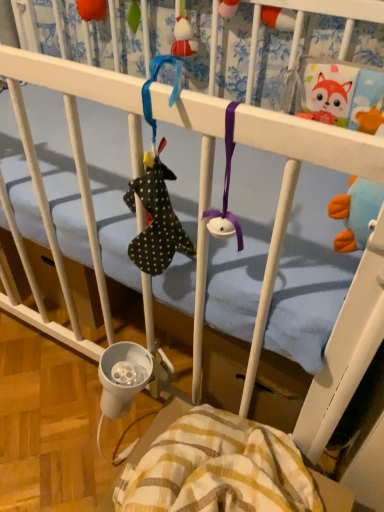
Measure the distance between matte red plush toy at upper center, the first toy positioned from the right, and camera.

matte red plush toy at upper center, the first toy positioned from the right, is 38.58 inches away from camera.

Where is `orange fabric toy at upper left, which is the 2th toy in right-to-left order`? orange fabric toy at upper left, which is the 2th toy in right-to-left order is located at coordinates (91, 9).

Find the location of a particular element. yellow striped fabric at lower center is located at coordinates (218, 469).

Considering the relative sizes of matte red plush toy at upper center, the first toy positioned from the right, and yellow striped fabric at lower center in the image provided, is matte red plush toy at upper center, the first toy positioned from the right, smaller than yellow striped fabric at lower center?

Indeed, matte red plush toy at upper center, the first toy positioned from the right, has a smaller size compared to yellow striped fabric at lower center.

From the image's perspective, which is below, matte red plush toy at upper center, which ranks as the second toy in left-to-right order, or yellow striped fabric at lower center?

yellow striped fabric at lower center.

Is matte red plush toy at upper center, which ranks as the second toy in left-to-right order, facing towards yellow striped fabric at lower center?

No, matte red plush toy at upper center, which ranks as the second toy in left-to-right order, is not aimed at yellow striped fabric at lower center.

Is the depth of matte red plush toy at upper center, which ranks as the second toy in left-to-right order, less than that of yellow striped fabric at lower center?

No, matte red plush toy at upper center, which ranks as the second toy in left-to-right order, is behind yellow striped fabric at lower center.

From a real-world perspective, between yellow striped fabric at lower center and matte red plush toy at upper center, the first toy positioned from the right, who is vertically lower?

Answer: In real-world perspective, yellow striped fabric at lower center is lower.

Is yellow striped fabric at lower center positioned in front of matte red plush toy at upper center, which ranks as the second toy in left-to-right order?

That is True.

How distant is yellow striped fabric at lower center from matte red plush toy at upper center, which ranks as the second toy in left-to-right order?

yellow striped fabric at lower center and matte red plush toy at upper center, which ranks as the second toy in left-to-right order, are 87.80 centimeters apart.

Which of these two, yellow striped fabric at lower center or matte red plush toy at upper center, which ranks as the second toy in left-to-right order, is bigger?

yellow striped fabric at lower center.

Does orange fabric toy at upper left, positioned as the first toy in left-to-right order, appear on the right side of matte red plush toy at upper center, which ranks as the second toy in left-to-right order?

No.

Can you confirm if orange fabric toy at upper left, positioned as the first toy in left-to-right order, is taller than matte red plush toy at upper center, the first toy positioned from the right?

In fact, orange fabric toy at upper left, positioned as the first toy in left-to-right order, may be shorter than matte red plush toy at upper center, the first toy positioned from the right.

From a real-world perspective, is orange fabric toy at upper left, positioned as the first toy in left-to-right order, on top of matte red plush toy at upper center, the first toy positioned from the right?

Answer: Yes, from a real-world perspective, orange fabric toy at upper left, positioned as the first toy in left-to-right order, is above matte red plush toy at upper center, the first toy positioned from the right.

Who is smaller, orange fabric toy at upper left, which is the 2th toy in right-to-left order, or matte red plush toy at upper center, which ranks as the second toy in left-to-right order?

Smaller between the two is orange fabric toy at upper left, which is the 2th toy in right-to-left order.

Based on the photo, how distant is orange fabric toy at upper left, positioned as the first toy in left-to-right order, from yellow striped fabric at lower center?

orange fabric toy at upper left, positioned as the first toy in left-to-right order, and yellow striped fabric at lower center are 1.10 meters apart from each other.

Could yellow striped fabric at lower center be considered to be inside orange fabric toy at upper left, which is the 2th toy in right-to-left order?

No, yellow striped fabric at lower center is not a part of orange fabric toy at upper left, which is the 2th toy in right-to-left order.

From the image's perspective, relative to yellow striped fabric at lower center, is orange fabric toy at upper left, which is the 2th toy in right-to-left order, above or below?

orange fabric toy at upper left, which is the 2th toy in right-to-left order, is above yellow striped fabric at lower center.

Considering the relative sizes of yellow striped fabric at lower center and orange fabric toy at upper left, which is the 2th toy in right-to-left order, in the image provided, is yellow striped fabric at lower center wider than orange fabric toy at upper left, which is the 2th toy in right-to-left order,?

Yes.

Which toy is the 2nd one when counting from the back of the yellow striped fabric at lower center? Please provide its 2D coordinates.

[(91, 9)]

From the image's perspective, is yellow striped fabric at lower center positioned above or below orange fabric toy at upper left, positioned as the first toy in left-to-right order?

yellow striped fabric at lower center is situated lower than orange fabric toy at upper left, positioned as the first toy in left-to-right order, in the image.

Could you tell me if yellow striped fabric at lower center is turned towards orange fabric toy at upper left, which is the 2th toy in right-to-left order?

No, yellow striped fabric at lower center is not turned towards orange fabric toy at upper left, which is the 2th toy in right-to-left order.

Based on the photo, can you confirm if matte red plush toy at upper center, which ranks as the second toy in left-to-right order, is positioned to the left of orange fabric toy at upper left, positioned as the first toy in left-to-right order?

No, matte red plush toy at upper center, which ranks as the second toy in left-to-right order, is not to the left of orange fabric toy at upper left, positioned as the first toy in left-to-right order.

Who is shorter, matte red plush toy at upper center, the first toy positioned from the right, or orange fabric toy at upper left, which is the 2th toy in right-to-left order?

orange fabric toy at upper left, which is the 2th toy in right-to-left order.

Would you say matte red plush toy at upper center, which ranks as the second toy in left-to-right order, is a long distance from orange fabric toy at upper left, positioned as the first toy in left-to-right order?

They are positioned close to each other.

Choose the correct answer: Is matte red plush toy at upper center, the first toy positioned from the right, inside orange fabric toy at upper left, which is the 2th toy in right-to-left order, or outside it?

matte red plush toy at upper center, the first toy positioned from the right, is spatially situated outside orange fabric toy at upper left, which is the 2th toy in right-to-left order.

In the image, there is a matte red plush toy at upper center, the first toy positioned from the right. At what (x,y) coordinates should I click in order to perform the action: click on blanket below it (from a real-world perspective). Please return your answer as a coordinate pair (x, y). The height and width of the screenshot is (512, 384). Looking at the image, I should click on (x=218, y=469).

Find the location of a particular element. The width and height of the screenshot is (384, 512). the 1st toy to the left of the yellow striped fabric at lower center, counting from the anchor's position is located at coordinates (183, 34).

From the image, which object appears to be nearer to yellow striped fabric at lower center, matte red plush toy at upper center, the first toy positioned from the right, or orange fabric toy at upper left, positioned as the first toy in left-to-right order?

matte red plush toy at upper center, the first toy positioned from the right.

Looking at the image, which one is located closer to yellow striped fabric at lower center, orange fabric toy at upper left, positioned as the first toy in left-to-right order, or matte red plush toy at upper center, which ranks as the second toy in left-to-right order?

Among the two, matte red plush toy at upper center, which ranks as the second toy in left-to-right order, is located nearer to yellow striped fabric at lower center.

Based on their spatial positions, is yellow striped fabric at lower center or orange fabric toy at upper left, which is the 2th toy in right-to-left order, further from matte red plush toy at upper center, the first toy positioned from the right?

Among the two, yellow striped fabric at lower center is located further to matte red plush toy at upper center, the first toy positioned from the right.

Considering their positions, is matte red plush toy at upper center, the first toy positioned from the right, positioned closer to orange fabric toy at upper left, which is the 2th toy in right-to-left order, than yellow striped fabric at lower center?

Based on the image, matte red plush toy at upper center, the first toy positioned from the right, appears to be nearer to orange fabric toy at upper left, which is the 2th toy in right-to-left order.

Which object lies nearer to the anchor point orange fabric toy at upper left, positioned as the first toy in left-to-right order, yellow striped fabric at lower center or matte red plush toy at upper center, which ranks as the second toy in left-to-right order?

matte red plush toy at upper center, which ranks as the second toy in left-to-right order, is closer to orange fabric toy at upper left, positioned as the first toy in left-to-right order.

Considering their positions, is orange fabric toy at upper left, which is the 2th toy in right-to-left order, positioned closer to matte red plush toy at upper center, which ranks as the second toy in left-to-right order, than yellow striped fabric at lower center?

orange fabric toy at upper left, which is the 2th toy in right-to-left order.

You are a GUI agent. You are given a task and a screenshot of the screen. Output one action in this format:
    pyautogui.click(x=<x>, y=<y>)
    Task: Click on the toy between orange fabric toy at upper left, positioned as the first toy in left-to-right order, and yellow striped fabric at lower center from top to bottom
    The height and width of the screenshot is (512, 384).
    Given the screenshot: What is the action you would take?
    coord(183,34)